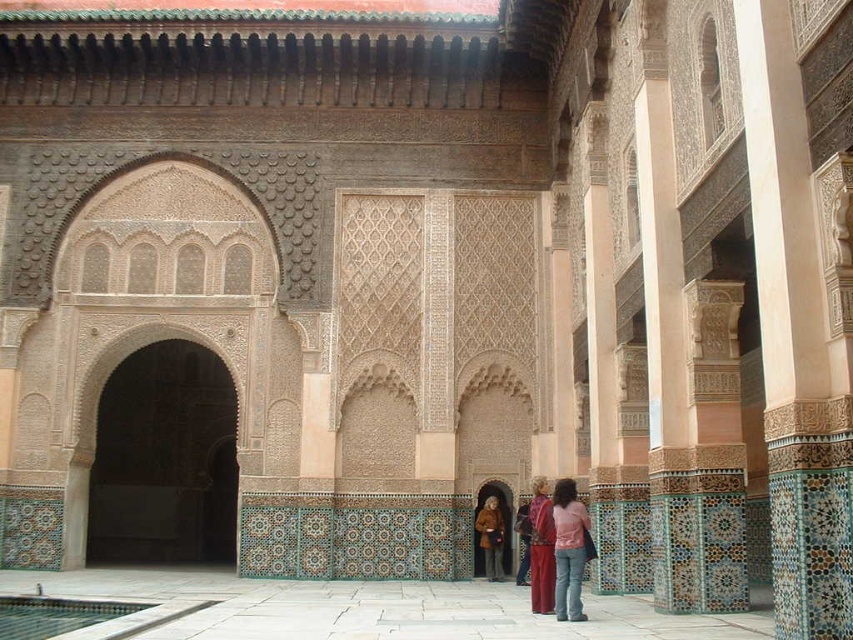
Question: Which point appears farthest from the camera in this image?

Choices:
 (A) (561, 593)
 (B) (265, 589)
 (C) (540, 566)
 (D) (103, 604)

Answer: (B)

Question: Which object is the closest to the brown leather jacket at center?

Choices:
 (A) pink fabric at lower center
 (B) matte red dress at lower center

Answer: (B)

Question: Is white stone floor at center below clear glass pool at lower left?

Choices:
 (A) yes
 (B) no

Answer: (A)

Question: Does matte red dress at lower center have a lesser width compared to brown leather jacket at center?

Choices:
 (A) yes
 (B) no

Answer: (B)

Question: Can you confirm if white stone floor at center is positioned to the right of pink fabric at lower center?

Choices:
 (A) yes
 (B) no

Answer: (B)

Question: Which of the following is the closest to the observer?

Choices:
 (A) (44, 624)
 (B) (538, 534)

Answer: (B)